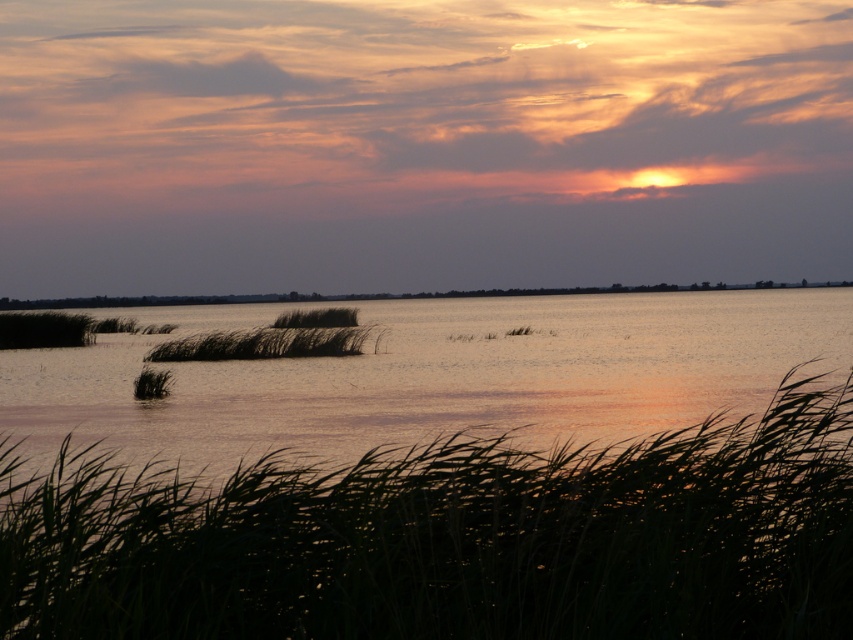
Can you confirm if green grass at center is taller than smooth water at center?

In fact, green grass at center may be shorter than smooth water at center.

Between point (838, 538) and point (9, 301), which one is positioned in front?

Point (838, 538) is in front.

The image size is (853, 640). In order to click on green grass at center in this screenshot , I will do `click(451, 538)`.

Is point (437, 296) positioned in front of point (350, 328)?

No, (437, 296) is behind (350, 328).

At what (x,y) coordinates should I click in order to perform the action: click on smooth water at center. Please return your answer as a coordinate pair (x, y). Looking at the image, I should click on (378, 294).

Does point (532, 292) come behind point (268, 332)?

Yes, point (532, 292) is behind point (268, 332).

Locate an element on the screen. smooth water at center is located at coordinates (378, 294).

Does point (514, 636) come behind point (16, 401)?

No.

Is green grass at center above silvery reeds at lower left?

Incorrect, green grass at center is not positioned above silvery reeds at lower left.

Is point (676, 451) more distant than point (784, 326)?

No.

The image size is (853, 640). Find the location of `green grass at center`. green grass at center is located at coordinates (451, 538).